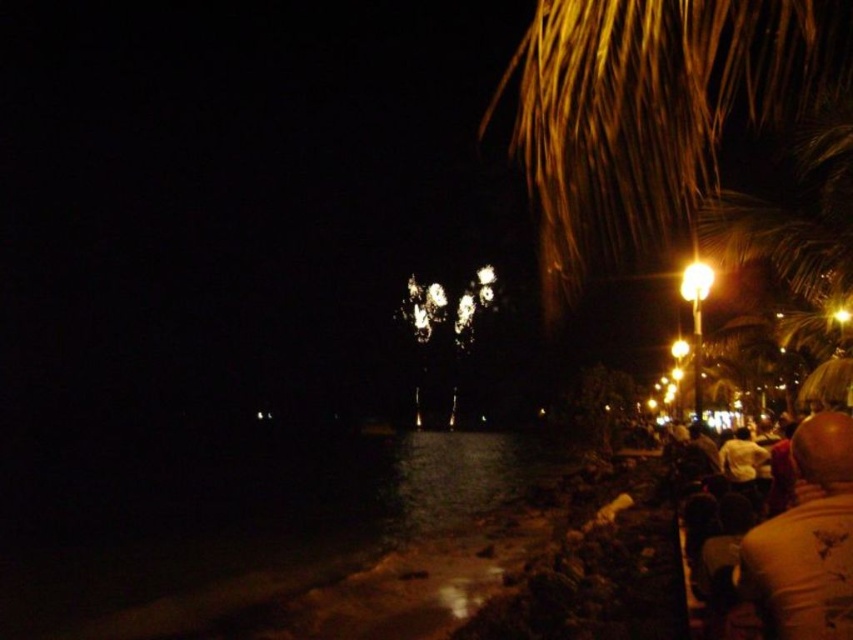
Question: Which point is closer to the camera?

Choices:
 (A) white t-shirt at lower right
 (B) white cotton shirt at lower right

Answer: (A)

Question: Among these points, which one is nearest to the camera?

Choices:
 (A) (817, 508)
 (B) (737, 440)
 (C) (630, 60)

Answer: (A)

Question: Can you confirm if brown textured palm tree at upper right is bigger than white t-shirt at lower right?

Choices:
 (A) yes
 (B) no

Answer: (A)

Question: Can you confirm if white t-shirt at lower right is positioned above white cotton shirt at lower right?

Choices:
 (A) no
 (B) yes

Answer: (B)

Question: Does brown textured palm tree at upper right have a greater width compared to white cotton shirt at lower right?

Choices:
 (A) no
 (B) yes

Answer: (B)

Question: Which point is closer to the camera?

Choices:
 (A) brown textured palm tree at upper right
 (B) white t-shirt at lower right

Answer: (B)